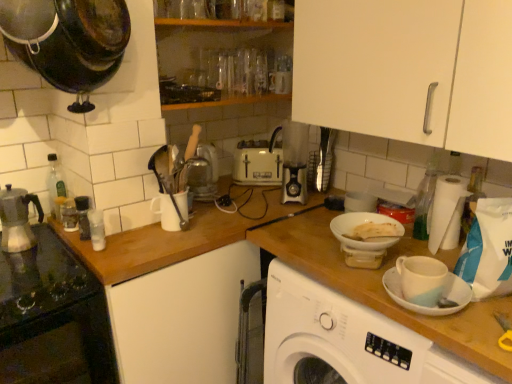
Locate an element on the screen. free space in front of white plastic toaster at center is located at coordinates (242, 192).